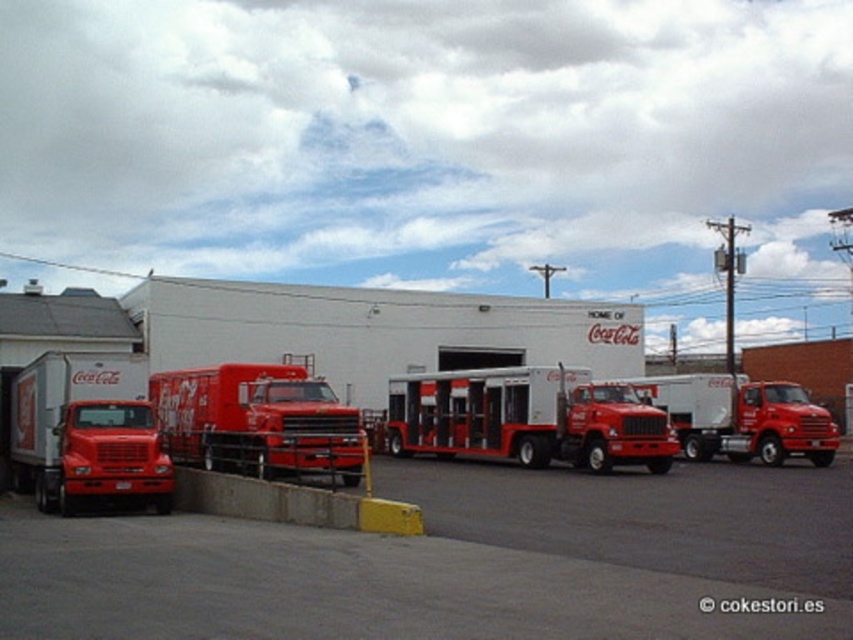
You are a Coca Cola delivery planner trying to park a new trailer in the yard. You have to choose between placing it next to the white glossy trailer at center or the matte white trailer truck at left. Which option will leave more space available for other vehicles?

The white glossy trailer at center occupies less space than the matte white trailer truck at left, so placing the new trailer next to the white glossy trailer at center will leave more space available for other vehicles.

You are a delivery supervisor in the Coca Cola yard. You need to move a new delivery truck that is 15 feet long into the space between the matte red truck at left and the matte red truck at center. Can the new truck fit in that space?

The space between the matte red truck at left and the matte red truck at center is 45.34 feet. Since the new delivery truck is only 15 feet long, it can easily fit in the available space.